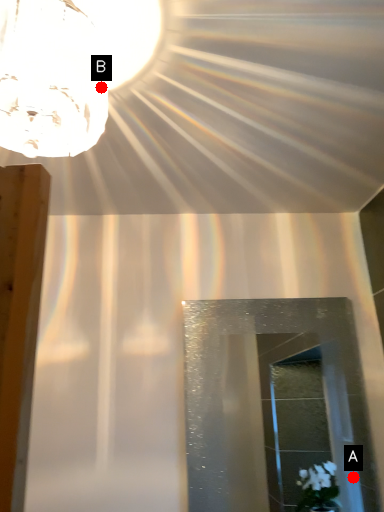
Question: Two points are circled on the image, labeled by A and B beside each circle. Which point appears closest to the camera in this image?

Choices:
 (A) A is closer
 (B) B is closer

Answer: (B)